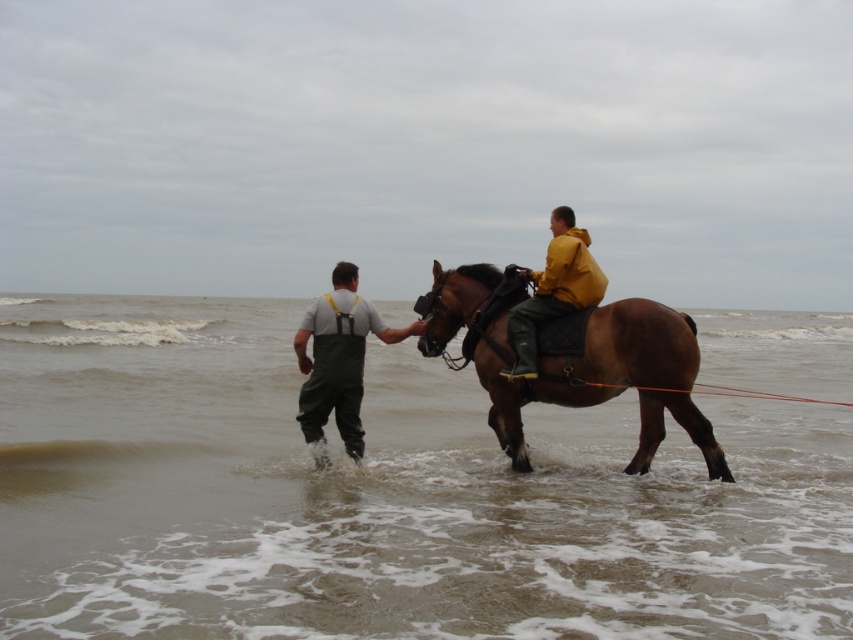
Which is more to the left, brown glossy horse at center or gray rubber boots at center?

From the viewer's perspective, gray rubber boots at center appears more on the left side.

How distant is brown glossy horse at center from gray rubber boots at center?

The distance of brown glossy horse at center from gray rubber boots at center is 5.76 feet.

Between point (625, 353) and point (360, 392), which one is positioned behind?

The point (360, 392) is behind.

Locate an element on the screen. brown glossy horse at center is located at coordinates (589, 364).

Is brown wet sand at lower center shorter than gray rubber boots at center?

Indeed, brown wet sand at lower center has a lesser height compared to gray rubber boots at center.

Is brown wet sand at lower center smaller than gray rubber boots at center?

No, brown wet sand at lower center is not smaller than gray rubber boots at center.

Locate an element on the screen. The height and width of the screenshot is (640, 853). brown wet sand at lower center is located at coordinates (381, 496).

Does gray rubber boots at center have a smaller size compared to yellow matte jacket at center?

No.

Is gray rubber boots at center positioned before yellow matte jacket at center?

Yes, it is in front of yellow matte jacket at center.

Does point (323, 388) lie in front of point (508, 372)?

No, it is not.

You are a GUI agent. You are given a task and a screenshot of the screen. Output one action in this format:
    pyautogui.click(x=<x>, y=<y>)
    Task: Click on the gray rubber boots at center
    The image size is (853, 640).
    Given the screenshot: What is the action you would take?
    pyautogui.click(x=338, y=358)